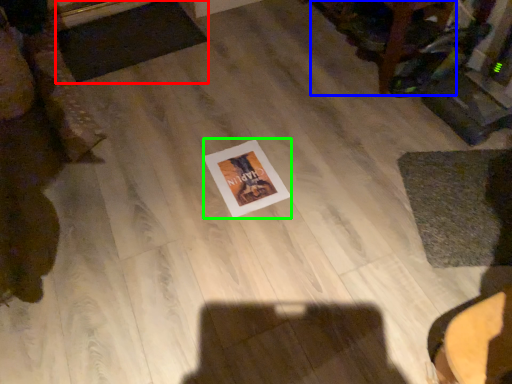
Question: Considering the real-world distances, which object is closest to mat (highlighted by a red box)? furniture (highlighted by a blue box) or postcard (highlighted by a green box).

Choices:
 (A) furniture
 (B) postcard

Answer: (B)